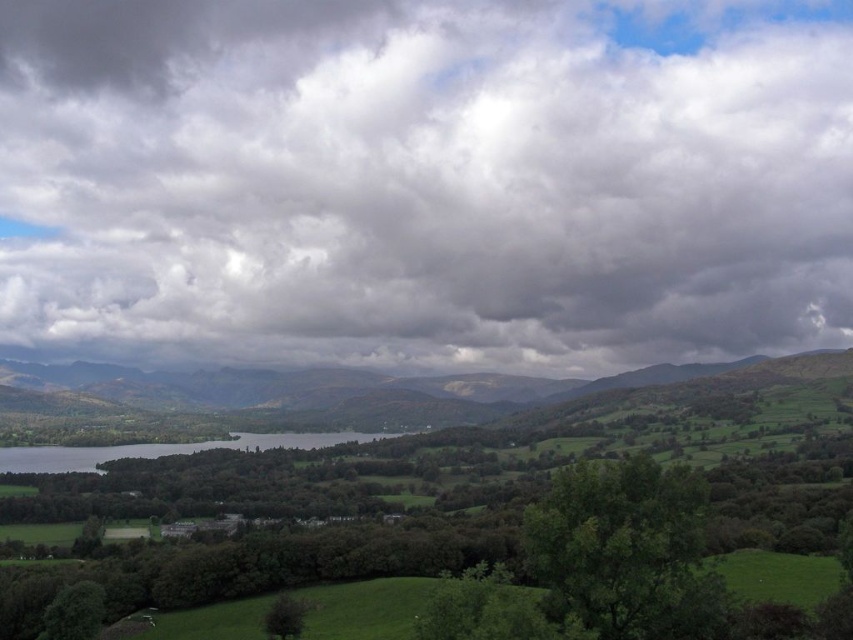
Question: Which object appears farthest from the camera in this image?

Choices:
 (A) cloudy sky at upper center
 (B) green grassy water at lower left

Answer: (A)

Question: Can you confirm if cloudy sky at upper center is bigger than green grassy water at lower left?

Choices:
 (A) no
 (B) yes

Answer: (B)

Question: Does cloudy sky at upper center have a larger size compared to green grassy water at lower left?

Choices:
 (A) yes
 (B) no

Answer: (A)

Question: Among these objects, which one is farthest from the camera?

Choices:
 (A) green grassy water at lower left
 (B) cloudy sky at upper center

Answer: (B)

Question: Considering the relative positions of cloudy sky at upper center and green grassy water at lower left in the image provided, where is cloudy sky at upper center located with respect to green grassy water at lower left?

Choices:
 (A) right
 (B) left

Answer: (A)